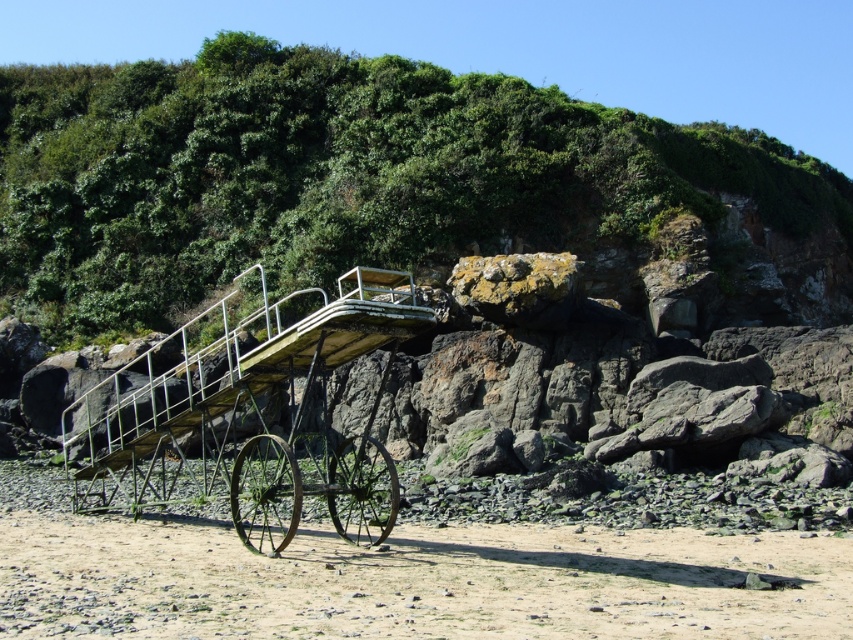
Question: Is green leafy vegetation at upper center thinner than green metal cart at center?

Choices:
 (A) yes
 (B) no

Answer: (B)

Question: Which point is farther to the camera?

Choices:
 (A) (347, 330)
 (B) (99, 88)

Answer: (B)

Question: Which object appears farthest from the camera in this image?

Choices:
 (A) green leafy vegetation at upper center
 (B) brown sandy beach at lower center
 (C) green metal cart at center

Answer: (A)

Question: Which point is farther from the camera taking this photo?

Choices:
 (A) (299, 392)
 (B) (209, 285)

Answer: (B)

Question: Is brown sandy beach at lower center smaller than green metal cart at center?

Choices:
 (A) no
 (B) yes

Answer: (B)

Question: Is green leafy vegetation at upper center above brown sandy beach at lower center?

Choices:
 (A) yes
 (B) no

Answer: (A)